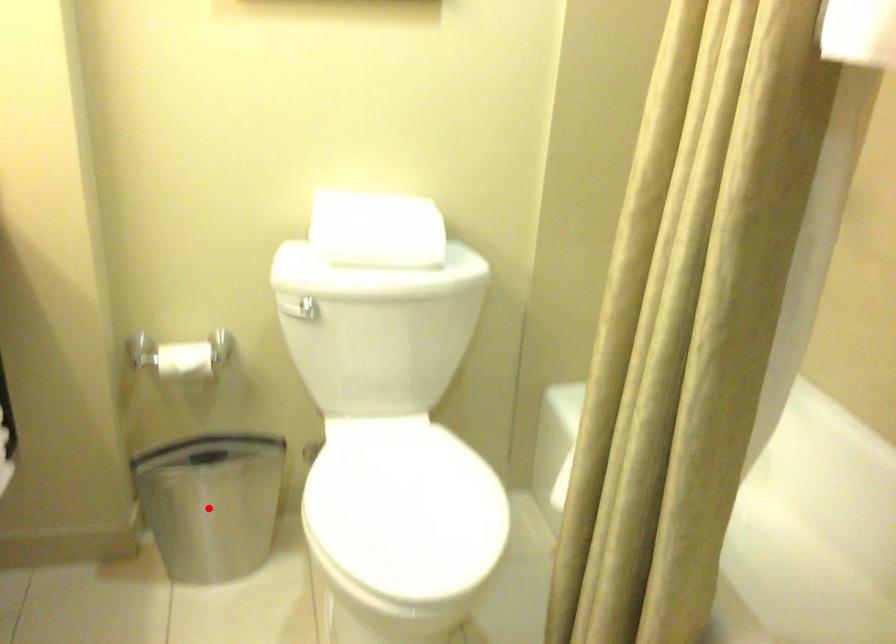
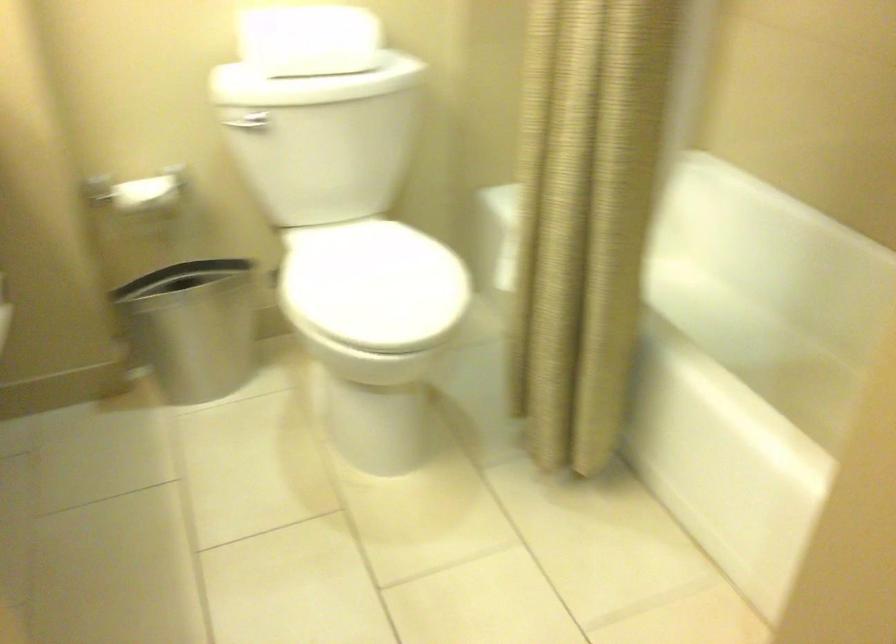
Where in the second image is the point corresponding to the highlighted location from the first image?

(194, 327)